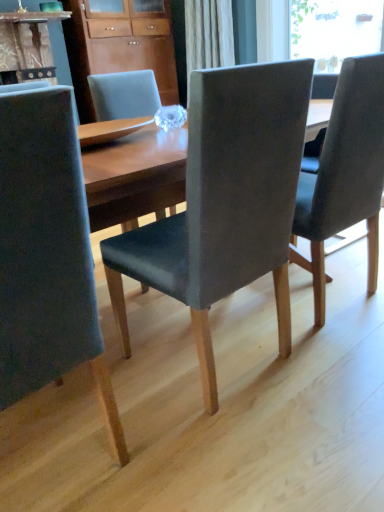
Find the location of a particular element. This screenshot has width=384, height=512. free space to the right of matte gray chair at center, acting as the second chair starting from the left is located at coordinates (325, 365).